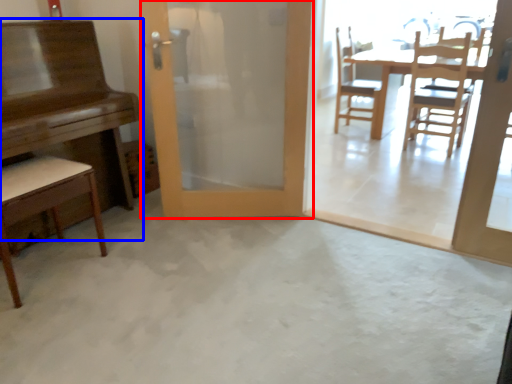
Question: Which object appears farthest to the camera in this image, door (highlighted by a red box) or table (highlighted by a blue box)?

Choices:
 (A) door
 (B) table

Answer: (A)